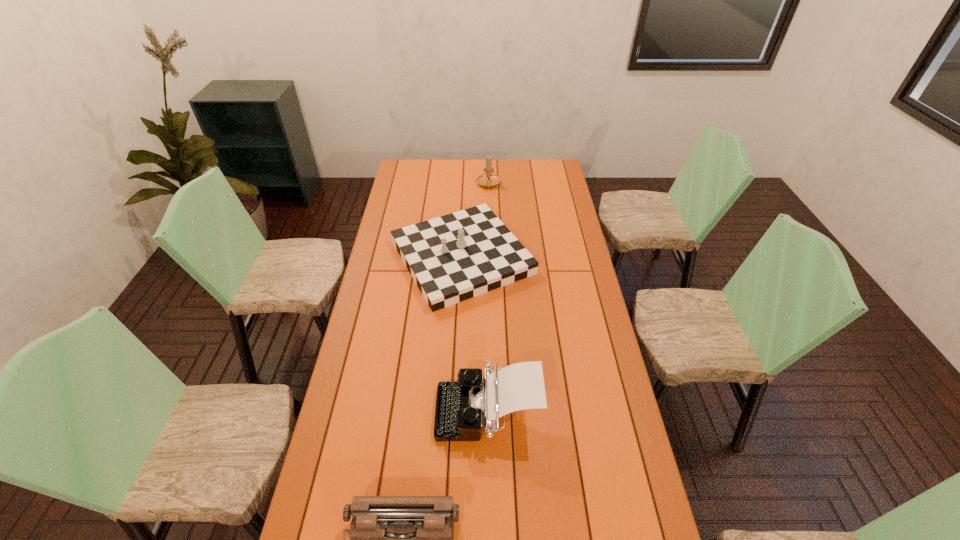
You are a GUI agent. You are given a task and a screenshot of the screen. Output one action in this format:
    pyautogui.click(x=<x>, y=<y>)
    Task: Click on the farthest object
    This screenshot has height=540, width=960.
    Given the screenshot: What is the action you would take?
    pyautogui.click(x=488, y=179)

Find the location of a particular element. This screenshot has width=960, height=540. the farther typewriter is located at coordinates (462, 407).

Locate an element on the screen. Image resolution: width=960 pixels, height=540 pixels. the second farthest object is located at coordinates (452, 258).

Locate an element on the screen. This screenshot has width=960, height=540. free point located 0.220m on the left of the candle is located at coordinates (436, 185).

You are a GUI agent. You are given a task and a screenshot of the screen. Output one action in this format:
    pyautogui.click(x=<x>, y=<y>)
    Task: Click on the free space located 0.220m on the keys of the farther typewriter
    
    Given the screenshot: What is the action you would take?
    pyautogui.click(x=367, y=410)

Where is `free spot located 0.320m on the keys of the farther typewriter`? The image size is (960, 540). free spot located 0.320m on the keys of the farther typewriter is located at coordinates (336, 410).

Identify the location of free location located 0.200m on the keys of the farther typewriter. (373, 410).

I want to click on vacant space located 0.210m on the right of the second farthest object, so click(583, 257).

Identify the location of object present at the far edge. This screenshot has width=960, height=540. pos(488,179).

Where is `object located at the left edge`? The width and height of the screenshot is (960, 540). object located at the left edge is located at coordinates (452, 258).